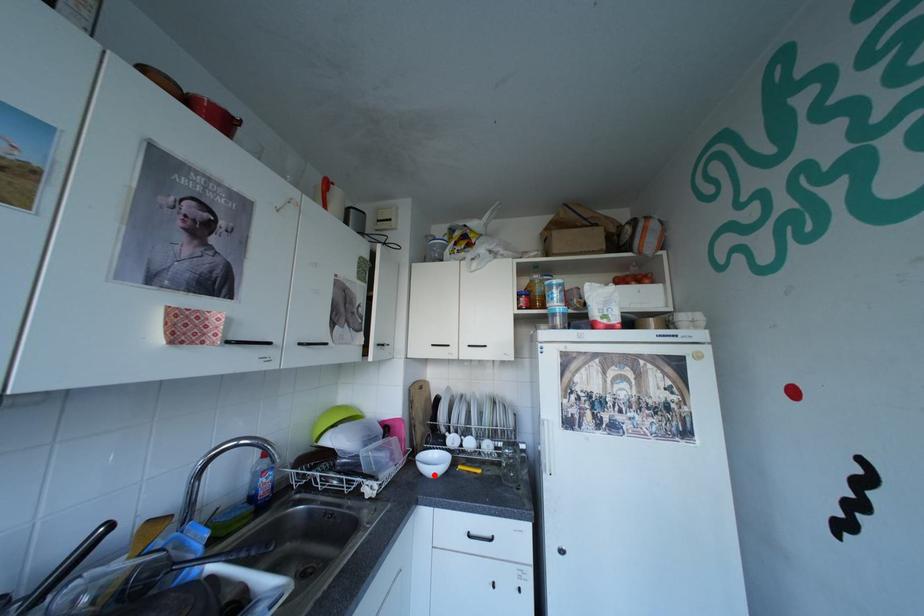
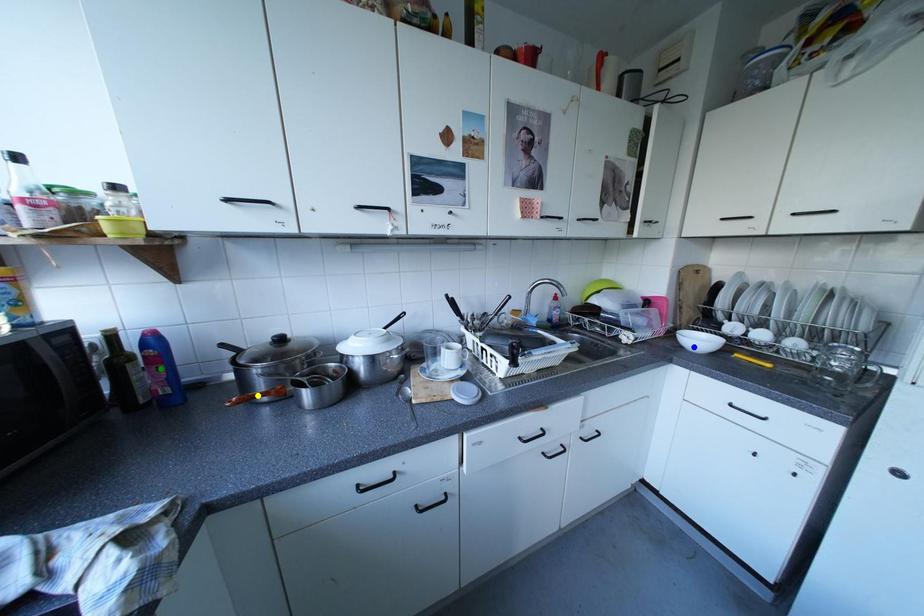
Question: I am providing you with two images of the same scene from different viewpoints. A red point is marked on the first image. You are given multiple points on the second image. Which mark in image 2 goes with the point in image 1?

Choices:
 (A) yellow point
 (B) green point
 (C) blue point

Answer: (C)